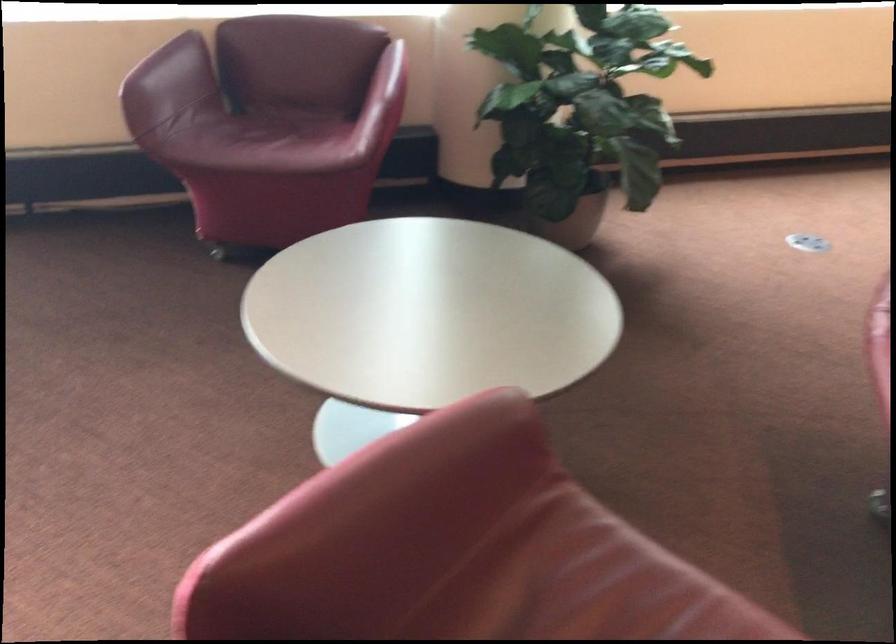
Find where to lift the plant pot. Please return your answer as a coordinate pair (x, y).

(573, 223)